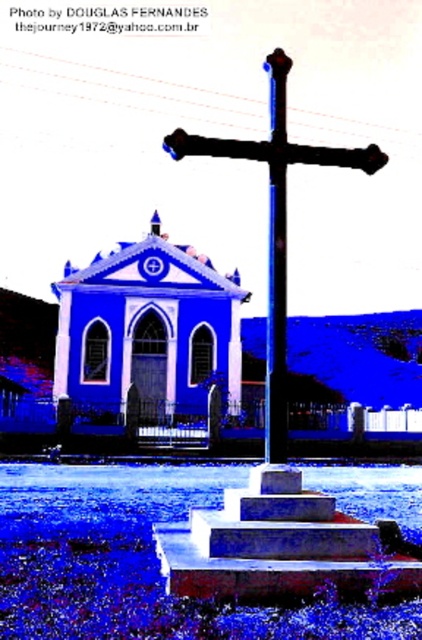
Question: Considering the relative positions of blue matte chapel at center and black metal cross at center in the image provided, where is blue matte chapel at center located with respect to black metal cross at center?

Choices:
 (A) above
 (B) below

Answer: (B)

Question: Can you confirm if black metal cross at center is bigger than metallic pole at center?

Choices:
 (A) yes
 (B) no

Answer: (A)

Question: Which of the following is the farthest from the observer?

Choices:
 (A) pyautogui.click(x=275, y=193)
 (B) pyautogui.click(x=187, y=317)
 (C) pyautogui.click(x=300, y=154)

Answer: (B)

Question: From the image, what is the correct spatial relationship of blue matte chapel at center in relation to black metal cross at center?

Choices:
 (A) right
 (B) left

Answer: (B)

Question: Among these points, which one is nearest to the camera?

Choices:
 (A) (265, 365)
 (B) (108, 342)

Answer: (A)

Question: Which of these objects is positioned farthest from the metallic pole at center?

Choices:
 (A) blue matte chapel at center
 (B) black metal cross at center

Answer: (A)